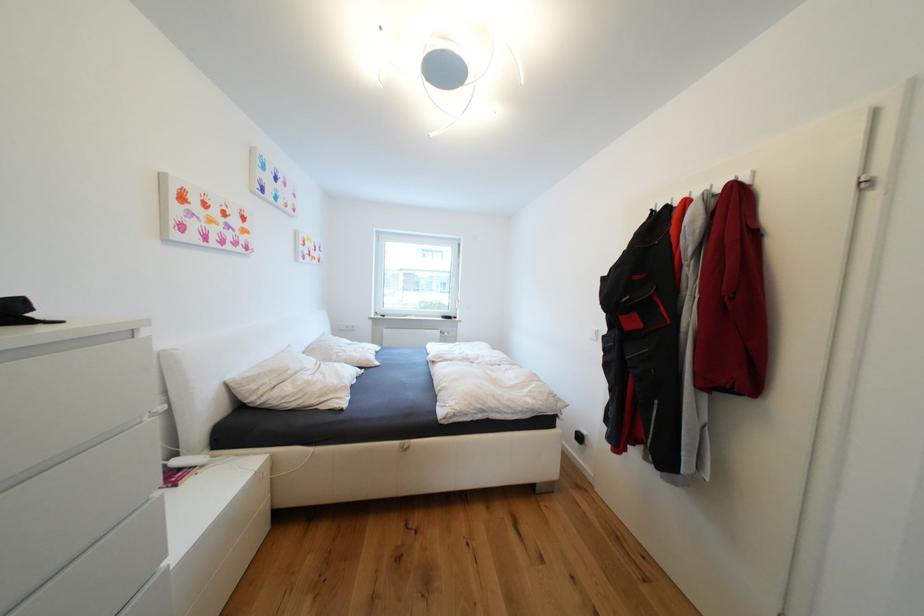
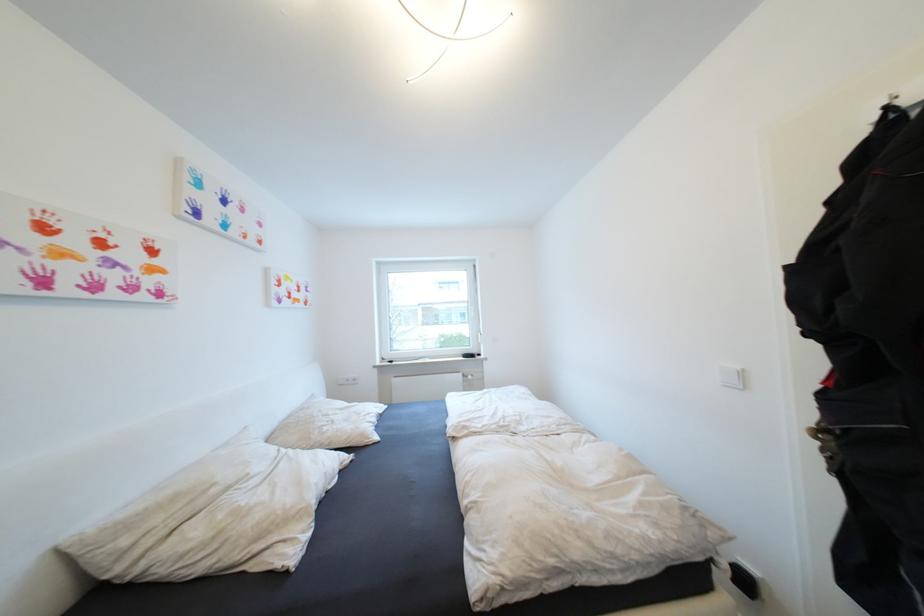
Question: The images are taken continuously from a first-person perspective. In which direction is your viewpoint rotating?

Choices:
 (A) Left
 (B) Right
 (C) Up
 (D) Down

Answer: (C)